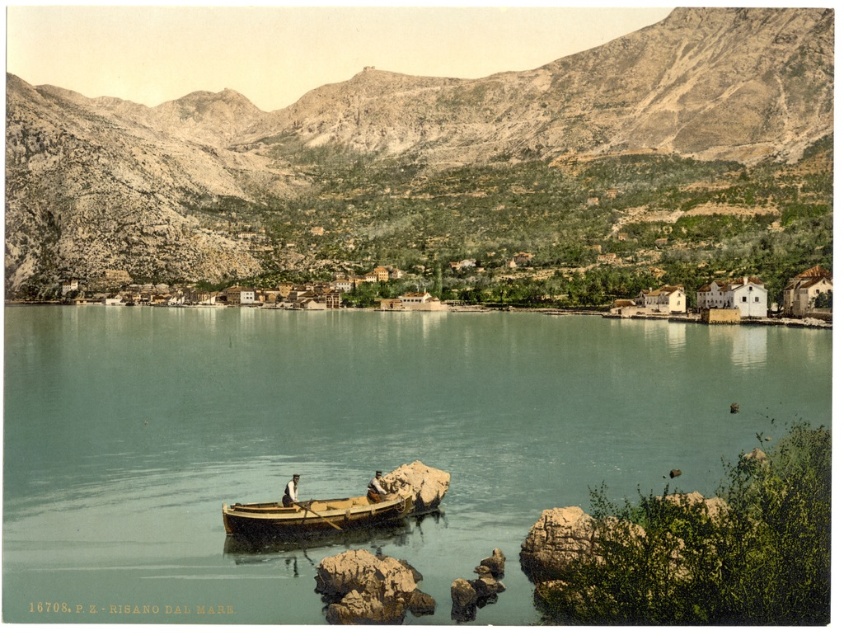
You are standing at the shore looking at the two points in the water. Which point, point (x=117, y=584) or point (x=116, y=264), is closer to you?

Point (x=117, y=584) is closer to you than point (x=116, y=264).

You are a photographer planning to capture the clear blue water at center in your shot. Based on its position, where should you focus your camera to ensure it is the main subject?

The clear blue water at center is located at point (x=349, y=440), so you should focus your camera at those coordinates to make it the main subject.